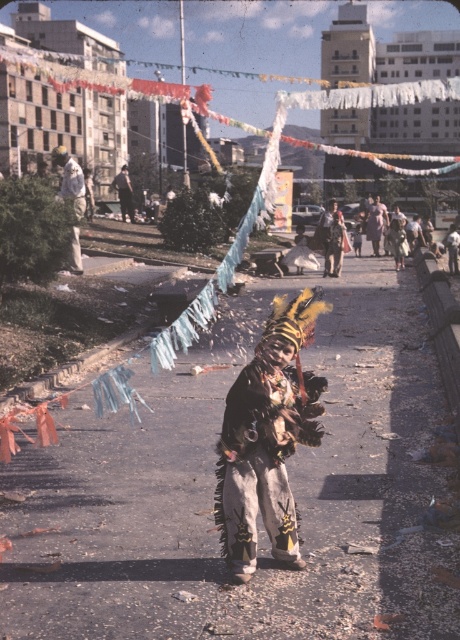
Question: Which of these objects is positioned farthest from the multicolored feathered headdress at center?

Choices:
 (A) fuzzy costume at center
 (B) dark brown leather jacket at center

Answer: (B)

Question: Which object is farther from the camera taking this photo?

Choices:
 (A) fuzzy costume at center
 (B) white cotton pants at center
 (C) dark brown leather jacket at center

Answer: (C)

Question: Does fuzzy costume at center appear on the right side of dark brown leather jacket at center?

Choices:
 (A) yes
 (B) no

Answer: (A)

Question: Can you confirm if fuzzy costume at center is wider than multicolored feathered headdress at center?

Choices:
 (A) no
 (B) yes

Answer: (B)

Question: Does fuzzy costume at center have a smaller size compared to multicolored feathered headdress at center?

Choices:
 (A) no
 (B) yes

Answer: (A)

Question: Which point is closer to the camera?

Choices:
 (A) (137, 467)
 (B) (317, 440)
 (C) (127, 193)
 (D) (326, 237)

Answer: (B)